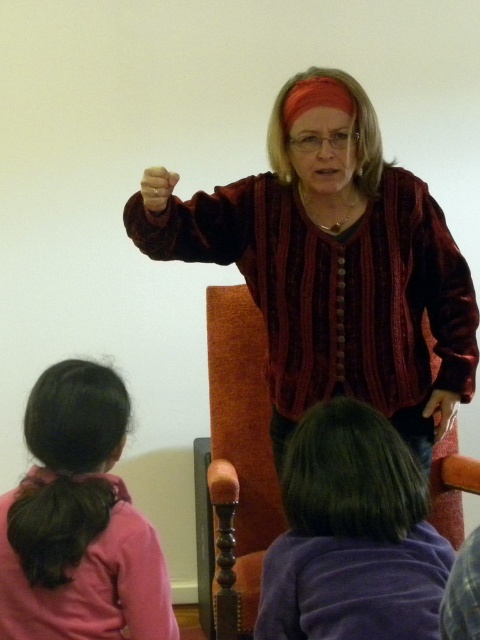
Question: Is pink fabric hair at lower left further to the viewer compared to purple velvet hair at lower center?

Choices:
 (A) yes
 (B) no

Answer: (A)

Question: Does pink fabric hair at lower left have a greater width compared to purple velvet hair at lower center?

Choices:
 (A) yes
 (B) no

Answer: (B)

Question: Which of the following is the closest to the observer?

Choices:
 (A) (90, 376)
 (B) (369, 632)

Answer: (B)

Question: Is pink fabric hair at lower left wider than purple velvet hair at lower center?

Choices:
 (A) yes
 (B) no

Answer: (B)

Question: Which object appears closest to the camera in this image?

Choices:
 (A) pink fabric hair at lower left
 (B) purple velvet hair at lower center

Answer: (B)

Question: Which point appears closest to the camera in this image?

Choices:
 (A) (175, 630)
 (B) (294, 540)

Answer: (B)